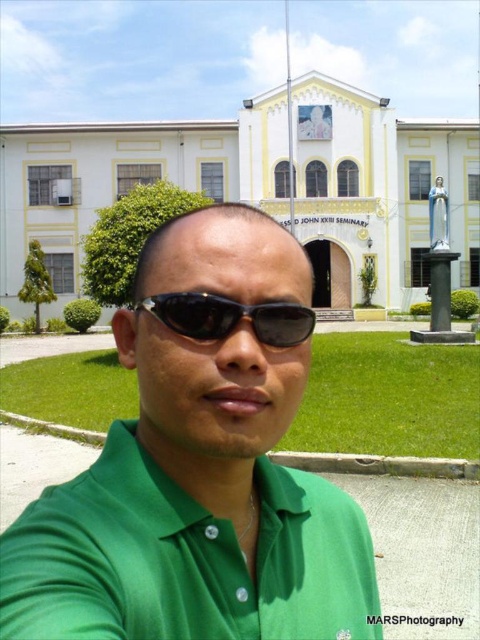
Question: Can you confirm if green matte shirt at center is positioned to the right of black reflective sunglasses at center?

Choices:
 (A) yes
 (B) no

Answer: (B)

Question: Among these objects, which one is nearest to the camera?

Choices:
 (A) green matte shirt at center
 (B) black reflective sunglasses at center
 (C) green satin dress shirt at center

Answer: (C)

Question: Can you confirm if green satin dress shirt at center is positioned below black reflective sunglasses at center?

Choices:
 (A) no
 (B) yes

Answer: (B)

Question: Which point is closer to the camera?

Choices:
 (A) (188, 314)
 (B) (104, 483)

Answer: (A)

Question: Which of the following is the farthest from the observer?

Choices:
 (A) (94, 483)
 (B) (207, 317)
 (C) (349, 497)

Answer: (C)

Question: Is green matte shirt at center thinner than black reflective sunglasses at center?

Choices:
 (A) no
 (B) yes

Answer: (A)